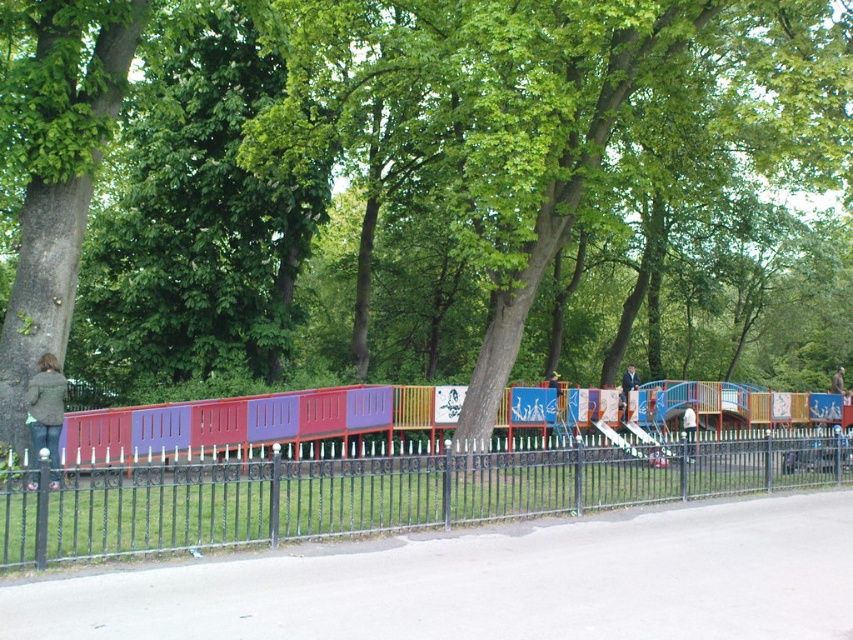
In the scene shown: You are a parent trying to decide whether to let your child play on the multicolored wooden train at center or wear the white fabric jacket at center first. Based on their sizes, which item is bigger?

The multicolored wooden train at center is larger in width than the white fabric jacket at center, so the multicolored wooden train at center is bigger.

You are a parent trying to decide where to place your child for a photo. The multicolored wooden train at center and the white fabric jacket at center are both in the scene. Which object should you position your child next to if you want them to appear taller in the photo?

Position your child next to the white fabric jacket at center because the multicolored wooden train at center is larger, making the jacket smaller in comparison. This will make the child look taller relative to the smaller object.

From the picture: You are a parent trying to decide whether to let your child play on the multicolored wooden train at center or wear the green textured jacket at left first. Based on their sizes, which item is bigger?

The multicolored wooden train at center is larger in size compared to the green textured jacket at left, so the train is bigger.